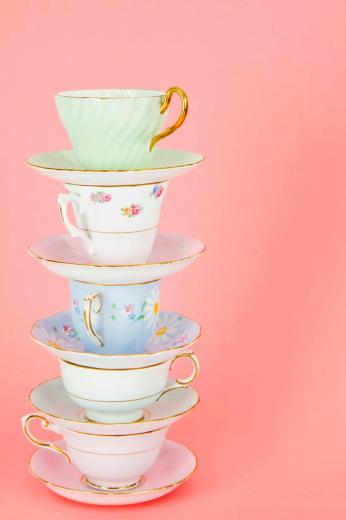
This screenshot has height=520, width=346. Identify the location of 5 teacups. (109, 133), (122, 452), (115, 399), (122, 309), (122, 218).